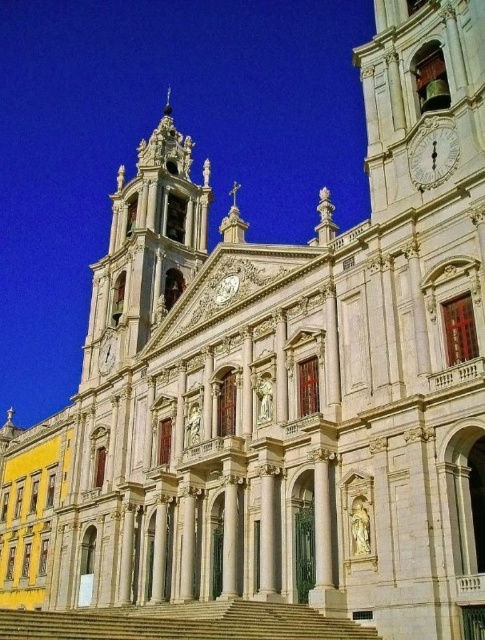
You are a tourist standing in front of the church and want to take a photo that includes both the gold ornate clock tower at upper left and the white textured clock at center. Which of the two clocks will appear larger in your photo?

The gold ornate clock tower at upper left will appear larger in the photo because it is much taller than the white textured clock at center.

You are standing at point (x=182, y=621) in the church facade scene. What object is located exactly at your current position?

The white marble stairs at center are located exactly at point (x=182, y=621).